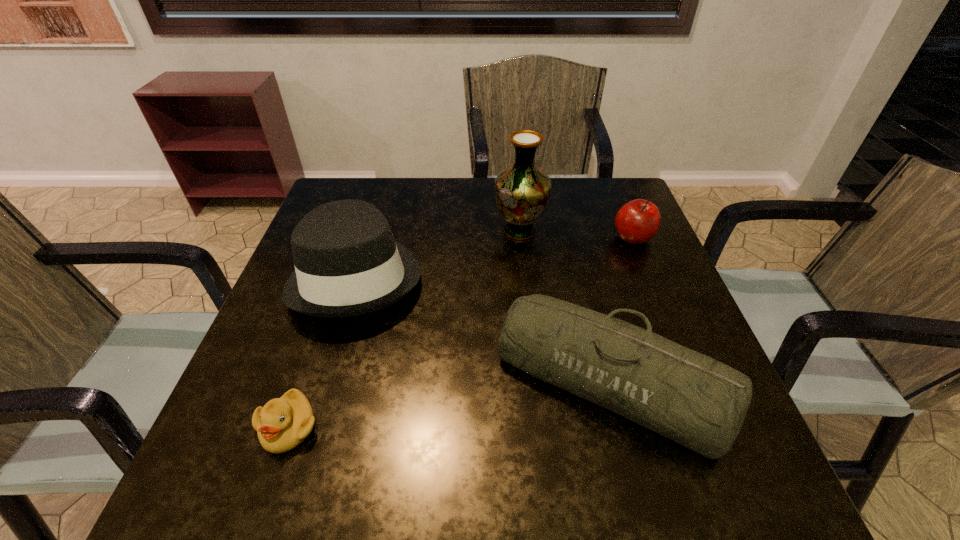
You are a GUI agent. You are given a task and a screenshot of the screen. Output one action in this format:
    pyautogui.click(x=<x>, y=<y>)
    Task: Click on the vase
    The width and height of the screenshot is (960, 540).
    Given the screenshot: What is the action you would take?
    pyautogui.click(x=522, y=190)

The image size is (960, 540). Identify the location of the fourth shortest object. (347, 263).

The width and height of the screenshot is (960, 540). In order to click on duffel bag in this screenshot , I will do point(688,397).

This screenshot has height=540, width=960. I want to click on apple, so click(x=636, y=222).

Identify the location of duckling. This screenshot has height=540, width=960. (283, 423).

Image resolution: width=960 pixels, height=540 pixels. In order to click on free space located 0.180m on the front of the tallest object in this screenshot , I will do `click(527, 299)`.

The width and height of the screenshot is (960, 540). I want to click on free space located 0.070m on the back of the second tallest object, so click(375, 215).

The width and height of the screenshot is (960, 540). Identify the location of vacant space positioned 0.050m on the back of the duffel bag. (588, 299).

At what (x,y) coordinates should I click in order to perform the action: click on free region located 0.100m on the back of the apple. Please return your answer as a coordinate pair (x, y). Looking at the image, I should click on (619, 204).

This screenshot has width=960, height=540. Find the location of `vacant position located on the front-facing side of the duckling`. vacant position located on the front-facing side of the duckling is located at coordinates (266, 496).